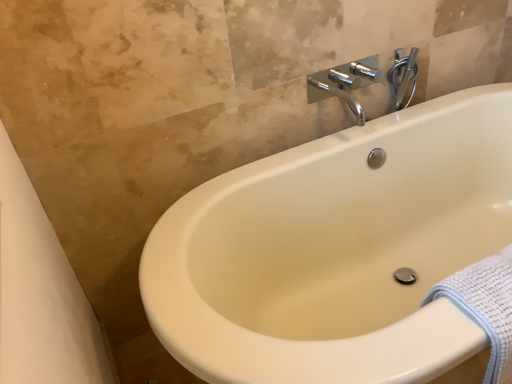
Question: Considering their positions, is chrome metallic faucet at upper center located in front of or behind white textured towel at lower right?

Choices:
 (A) front
 (B) behind

Answer: (B)

Question: Choose the correct answer: Is chrome metallic faucet at upper center inside white textured towel at lower right or outside it?

Choices:
 (A) inside
 (B) outside

Answer: (B)

Question: Which of these objects is positioned farthest from the chrome metallic faucet at upper right?

Choices:
 (A) white textured towel at lower right
 (B) chrome metallic faucet at upper center

Answer: (A)

Question: Estimate the real-world distances between objects in this image. Which object is farther from the chrome metallic faucet at upper center?

Choices:
 (A) white textured towel at lower right
 (B) chrome metallic faucet at upper right

Answer: (A)